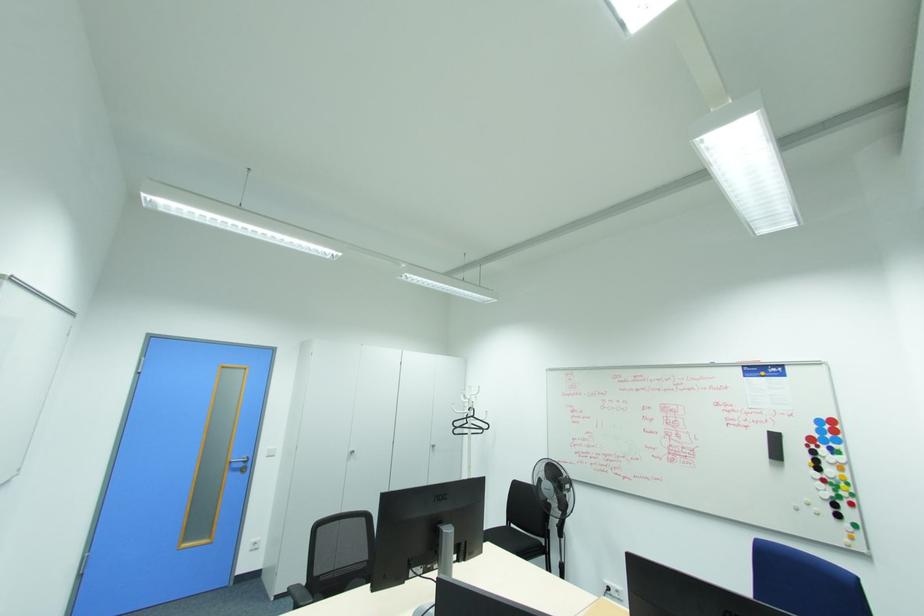
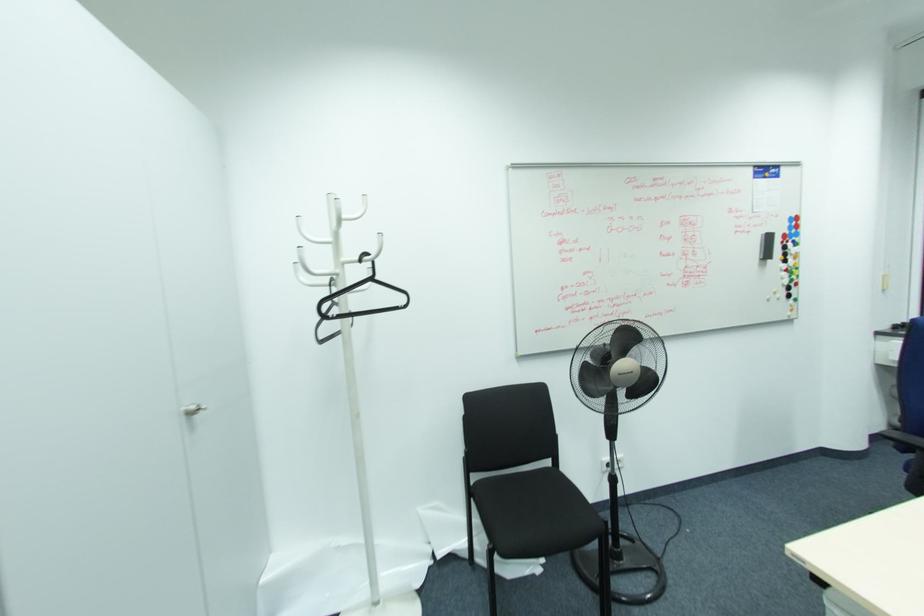
Where in the second image is the point corresponding to point 833,446 from the first image?

(796, 238)